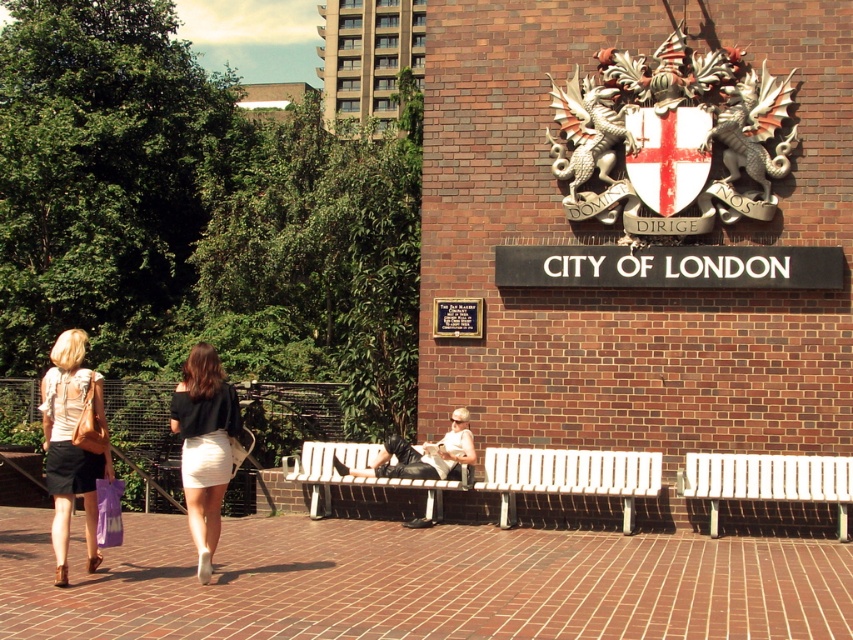
Question: Can you confirm if white textured skirt at lower left is bigger than white plastic bench at right?

Choices:
 (A) yes
 (B) no

Answer: (A)

Question: Is matte beige skirt at lower left behind purple fabric shopping bag at lower left?

Choices:
 (A) no
 (B) yes

Answer: (A)

Question: Which of the following is the closest to the observer?

Choices:
 (A) (415, 451)
 (B) (91, 474)
 (C) (219, 371)
 (D) (532, 464)

Answer: (B)

Question: Where is white textured skirt at lower left located in relation to purple fabric shopping bag at lower left in the image?

Choices:
 (A) above
 (B) below

Answer: (A)

Question: Which point is farther to the camera?

Choices:
 (A) pyautogui.click(x=527, y=465)
 (B) pyautogui.click(x=456, y=410)
 (C) pyautogui.click(x=799, y=483)
 (D) pyautogui.click(x=387, y=484)

Answer: (B)

Question: Which point is farther from the camera taking this photo?

Choices:
 (A) (115, 540)
 (B) (204, 531)
 (C) (550, 477)

Answer: (C)